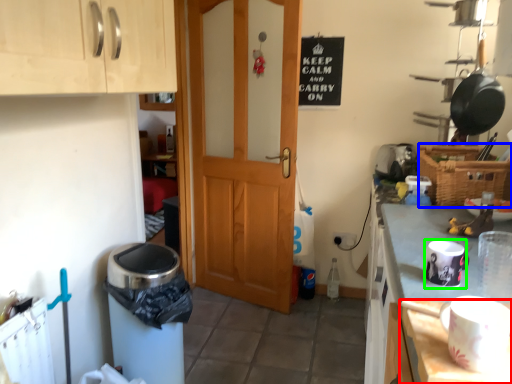
Question: Which object is positioned farthest from table (highlighted by a red box)? Select from basket (highlighted by a blue box) and appliance (highlighted by a green box).

Choices:
 (A) basket
 (B) appliance

Answer: (A)